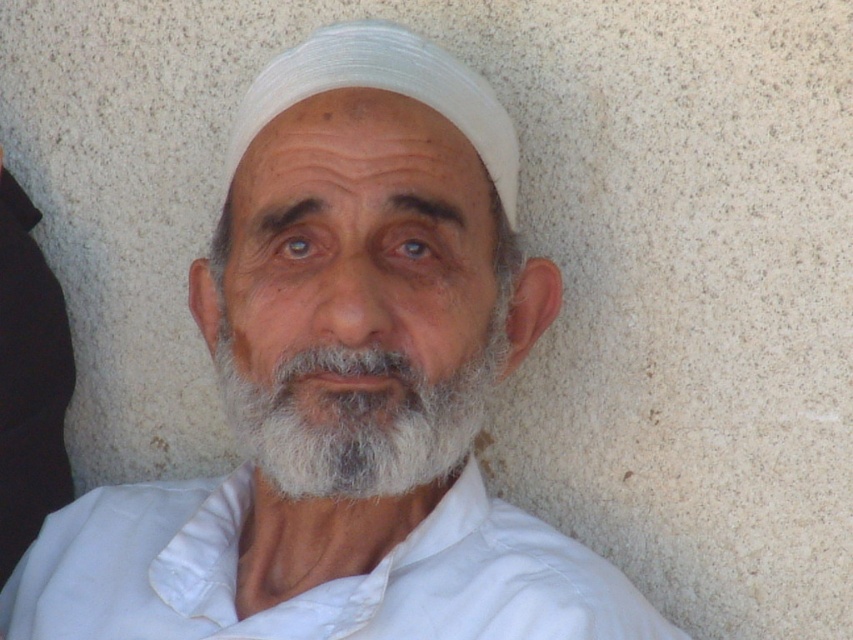
You are a photographer trying to capture the elderly man in the scene. The camera is positioned such that the center of the frame is at coordinates point (x=318, y=584). What object is located at the center of the frame?

The point (x=318, y=584) corresponds to the white cotton shirt at center, so the object at the center of the frame is the white cotton shirt at center.

You are taking a photo of the elderly man and notice two points in the image. One is at point (489, 276) and the other at point (77, 586). Which point is closer to the camera?

Point (489, 276) is in front of point (77, 586), so it is closer to the camera.

You are a photographer who needs to adjust the lighting to ensure both the white cotton shirt at center and the white fabric headscarf at center are visible. Which object should you focus on first to balance the exposure?

The white cotton shirt at center is located below the white fabric headscarf at center. Since the headscarf is above the shirt, it might receive more direct light, so start by adjusting exposure for the white fabric headscarf at center to prevent overexposure, then balance for the white cotton shirt at center.